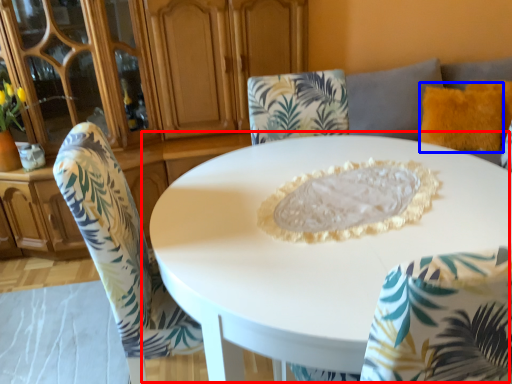
Question: Which of the following is the closest to the observer, table (highlighted by a red box) or pillow (highlighted by a blue box)?

Choices:
 (A) table
 (B) pillow

Answer: (A)